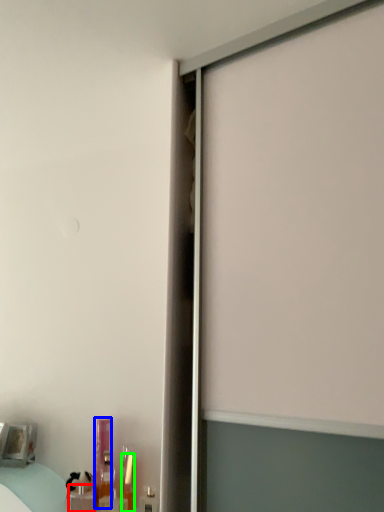
Question: Considering the real-world distances, which object is closest to toiletry (highlighted by a red box)? toiletry (highlighted by a blue box) or toiletry (highlighted by a green box).

Choices:
 (A) toiletry
 (B) toiletry

Answer: (A)